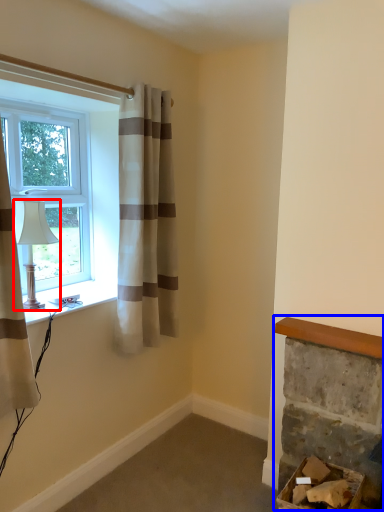
Question: Which object is further to the camera taking this photo, lamp (highlighted by a red box) or fireplace (highlighted by a blue box)?

Choices:
 (A) lamp
 (B) fireplace

Answer: (A)